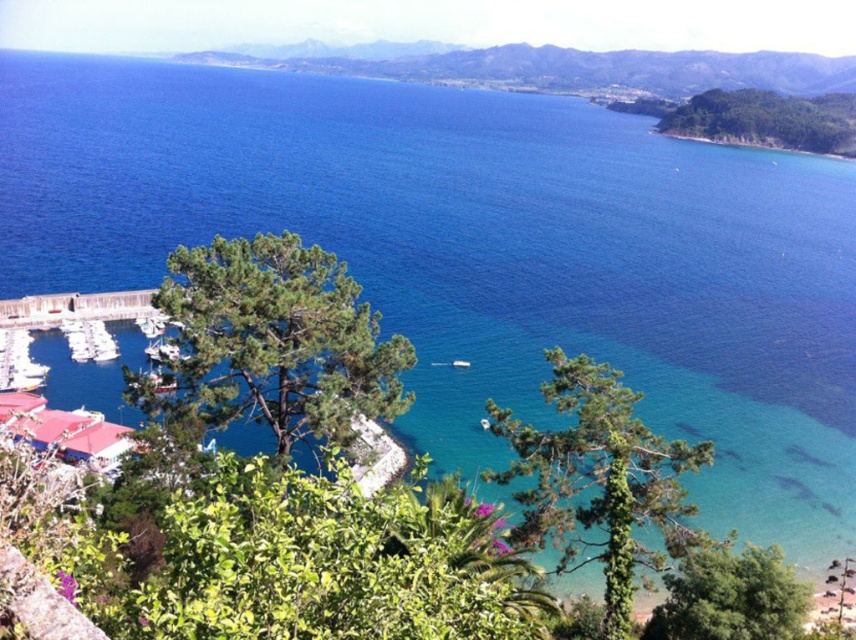
Find the location of a particular element. This screenshot has width=856, height=640. brown wooden dock at lower left is located at coordinates (76, 308).

Which of these two, brown wooden dock at lower left or white glossy boat at lower left, stands shorter?

brown wooden dock at lower left is shorter.

Is point (97, 314) farther from viewer compared to point (9, 332)?

Yes, point (97, 314) is farther from viewer.

This screenshot has height=640, width=856. In order to click on brown wooden dock at lower left in this screenshot , I will do point(76,308).